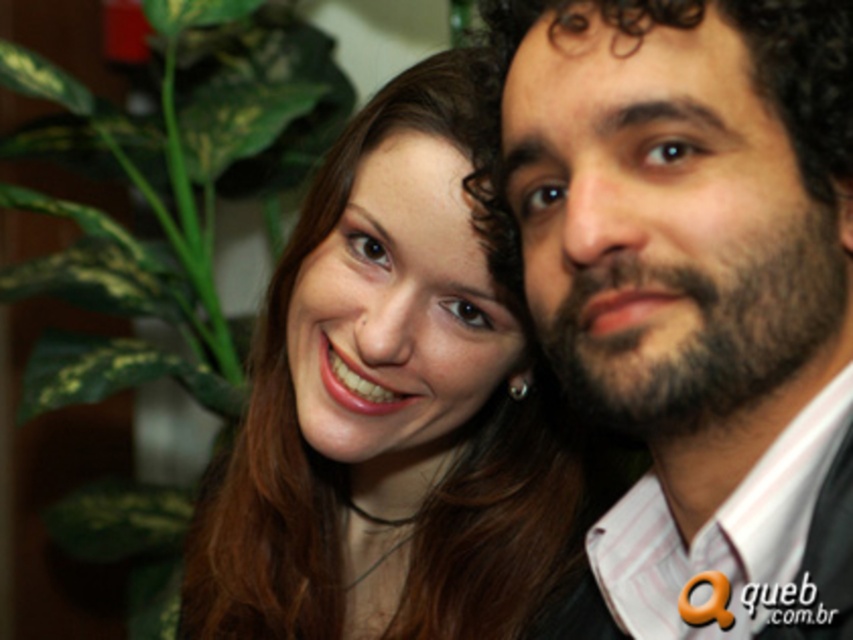
Question: Is dark brown curly hair at right below green leafy plant at left?

Choices:
 (A) yes
 (B) no

Answer: (A)

Question: Can you confirm if dark brown curly hair at right is wider than green leafy plant at left?

Choices:
 (A) yes
 (B) no

Answer: (B)

Question: Does matte skin at center appear over green leafy plant at left?

Choices:
 (A) yes
 (B) no

Answer: (B)

Question: Which point is closer to the camera?

Choices:
 (A) (456, 369)
 (B) (141, 129)

Answer: (A)

Question: Which point appears farthest from the camera in this image?

Choices:
 (A) (527, 49)
 (B) (218, 10)

Answer: (B)

Question: Among these points, which one is nearest to the camera?

Choices:
 (A) (630, 577)
 (B) (231, 556)

Answer: (A)